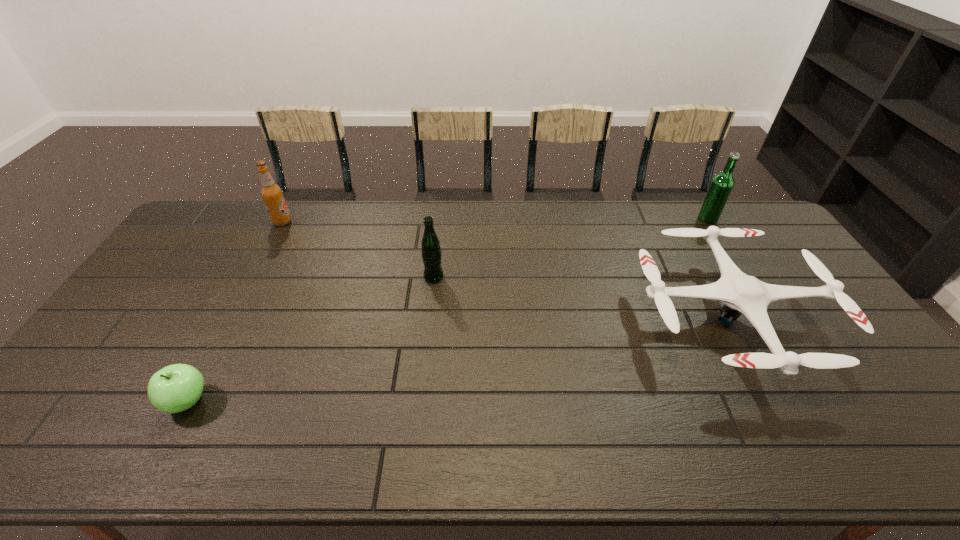
You are a GUI agent. You are given a task and a screenshot of the screen. Output one action in this format:
    pyautogui.click(x=<x>, y=<y>)
    Task: Click on the vacant space that's between the leftmost beer bottle and the second shortest object
    
    Given the screenshot: What is the action you would take?
    pyautogui.click(x=506, y=269)

The height and width of the screenshot is (540, 960). Identify the location of vacant area that lies between the drone and the apple. (459, 359).

You are a GUI agent. You are given a task and a screenshot of the screen. Output one action in this format:
    pyautogui.click(x=<x>, y=<y>)
    Task: Click on the free space between the drone and the second beer bottle from right to left
    This screenshot has height=540, width=960.
    Given the screenshot: What is the action you would take?
    pyautogui.click(x=582, y=296)

Locate an element on the screen. Image resolution: width=960 pixels, height=540 pixels. free space between the apple and the fourth tallest object is located at coordinates click(459, 359).

Where is `empty space that is in between the apple and the leftmost beer bottle`? This screenshot has height=540, width=960. empty space that is in between the apple and the leftmost beer bottle is located at coordinates pyautogui.click(x=235, y=312).

This screenshot has width=960, height=540. Find the location of `free space that is in between the fourth tallest object and the second beer bottle from left to right`. free space that is in between the fourth tallest object and the second beer bottle from left to right is located at coordinates (582, 296).

Identify the location of vacant point located between the apple and the rightmost beer bottle. (447, 310).

Identify the location of object that ranks as the third closest to the second beer bottle from left to right. The image size is (960, 540). (175, 388).

Locate which object is the closest to the leftmost beer bottle. Please provide its 2D coordinates. Your answer should be formatted as a tuple, i.e. [(x, y)], where the tuple contains the x and y coordinates of a point satisfying the conditions above.

[(431, 253)]

Point out which beer bottle is positioned as the second nearest to the second beer bottle from right to left. Please provide its 2D coordinates. Your answer should be formatted as a tuple, i.e. [(x, y)], where the tuple contains the x and y coordinates of a point satisfying the conditions above.

[(722, 184)]